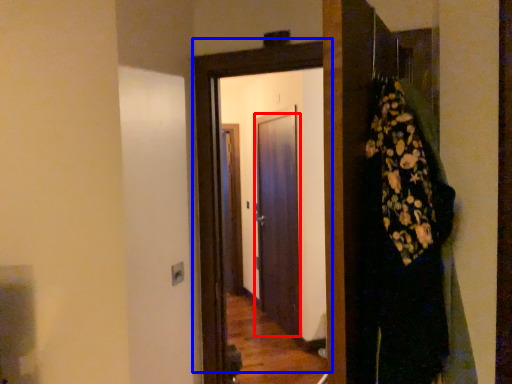
Question: Which point is closer to the camera, door (highlighted by a red box) or door (highlighted by a blue box)?

Choices:
 (A) door
 (B) door

Answer: (B)